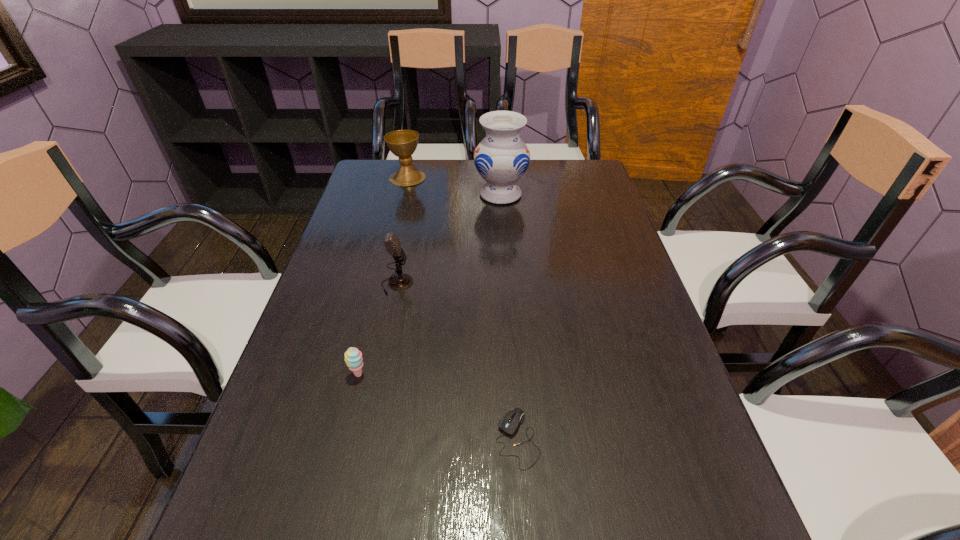
Find the location of a particular element. The image size is (960, 540). free space that is in between the chalice and the computer mouse is located at coordinates (463, 308).

I want to click on free space between the tallest object and the chalice, so click(x=454, y=186).

This screenshot has height=540, width=960. Identify the location of free space between the chalice and the fourth farthest object. (383, 276).

Identify which object is the closest to the computer mouse. Please provide its 2D coordinates. Your answer should be formatted as a tuple, i.e. [(x, y)], where the tuple contains the x and y coordinates of a point satisfying the conditions above.

[(353, 357)]

Locate which object ranks third in proximity to the sherbert. Please provide its 2D coordinates. Your answer should be formatted as a tuple, i.e. [(x, y)], where the tuple contains the x and y coordinates of a point satisfying the conditions above.

[(501, 158)]

At what (x,y) coordinates should I click in order to perform the action: click on vacant point that satisfies the following two spatial constraints: 1. on the front-facing side of the third farthest object; 2. on the right side of the nearest object. Please return your answer as a coordinate pair (x, y). Looking at the image, I should click on (366, 438).

Find the location of a particular element. This screenshot has height=540, width=960. free spot that satisfies the following two spatial constraints: 1. on the front side of the tallest object; 2. on the front-facing side of the third farthest object is located at coordinates (507, 284).

Locate an element on the screen. This screenshot has height=540, width=960. vacant region that satisfies the following two spatial constraints: 1. on the back side of the second nearest object; 2. on the left side of the chalice is located at coordinates (407, 178).